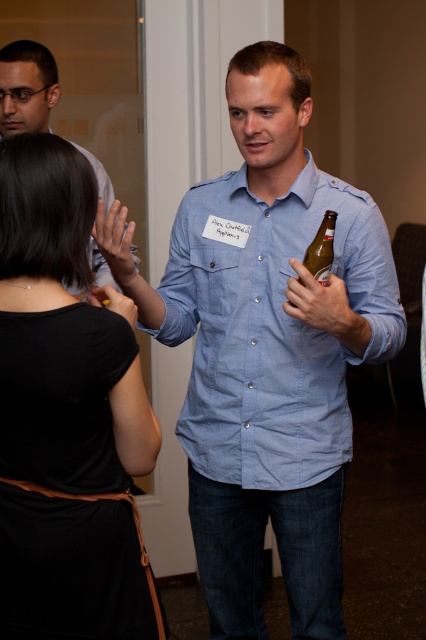
You are a bartender who needs to place a drink on the table between the blue denim shirt at center and the translucent glass bottle at center. The drink requires 12 inches of space. Is there enough space?

The distance between the blue denim shirt at center and the translucent glass bottle at center is 11.93 inches, which is slightly less than the required 12 inches. Therefore, there is not enough space to place the drink.

You are at a networking event and need to hand out a promotional item. You see the blue denim shirt at center and the translucent glass bottle at center. Which object is closer to you, and why?

The blue denim shirt at center is closer to you because the translucent glass bottle at center is behind it.

You are at a networking event and see a man with a name tag that says Alex Onfield holding a brown bottle. There is also a point marked at coordinates [270,326]. What object is located at that point?

The point at [270,326] corresponds to the blue denim shirt at center.